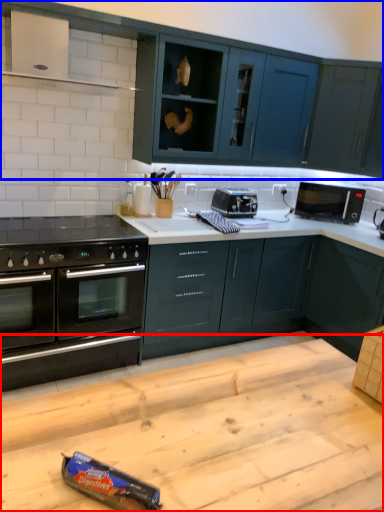
Question: Which point is further to the camera, table (highlighted by a red box) or cabinetry (highlighted by a blue box)?

Choices:
 (A) table
 (B) cabinetry

Answer: (B)